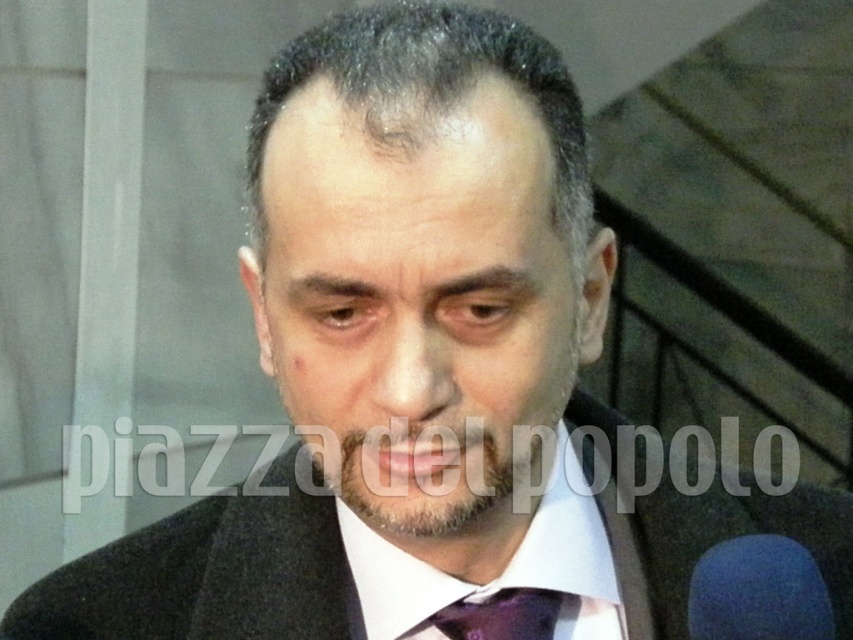
Looking at this image, you are a photographer standing at the camera position. You want to take a photo of the man in the image. The focus point of your camera is set to point (338, 324). If your camera has a depth of field that can cover objects within 16 inches from the focus point, will the man be in focus?

The point (338, 324) and camera are 16.36 inches apart. Since the depth of field covers up to 16 inches, the man might be slightly out of focus as the distance exceeds the depth of field limit by 0.36 inches.

Based on the scene description, which object, the smooth skin face at center or the dark gray wool suit at center, occupies a larger portion of the image?

The smooth skin face at center is larger in size than the dark gray wool suit at center, so the smooth skin face at center occupies a larger portion of the image.